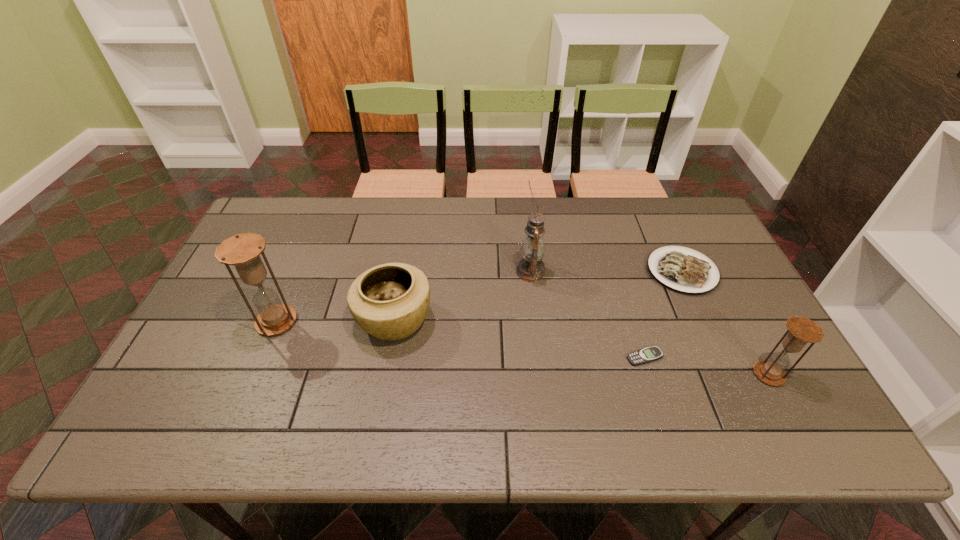
I want to click on unoccupied area between the oil lamp and the nearer hourglass, so click(x=650, y=323).

Locate an element on the screen. Image resolution: width=960 pixels, height=540 pixels. free area in between the third object from left to right and the second shortest object is located at coordinates (606, 272).

The width and height of the screenshot is (960, 540). I want to click on free spot between the beeper and the farther hourglass, so click(461, 340).

The width and height of the screenshot is (960, 540). Identify the location of blank region between the second shortest object and the taller hourglass. (479, 296).

Locate an element on the screen. The height and width of the screenshot is (540, 960). free space between the fourth tallest object and the third object from right to left is located at coordinates click(x=519, y=339).

Identify the location of free spot between the second object from left to right and the fourth object from right to left. The width and height of the screenshot is (960, 540). click(463, 296).

Select which object is the fifth closest to the fourth object from left to right. Please provide its 2D coordinates. Your answer should be formatted as a tuple, i.e. [(x, y)], where the tuple contains the x and y coordinates of a point satisfying the conditions above.

[(243, 251)]

I want to click on object that stands as the third closest to the plate, so click(x=530, y=268).

I want to click on vacant space that satisfies the following two spatial constraints: 1. on the back side of the second tallest object; 2. on the right side of the third shortest object, so click(277, 320).

Identify the location of vacant position in the image that satisfies the following two spatial constraints: 1. on the front side of the nearer hourglass; 2. on the right side of the shortest object. Image resolution: width=960 pixels, height=540 pixels. (650, 374).